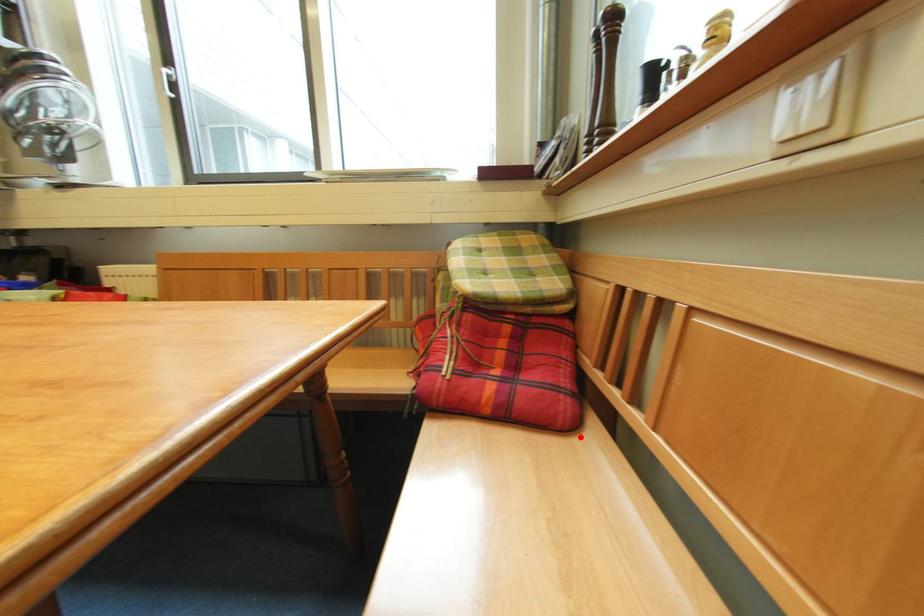
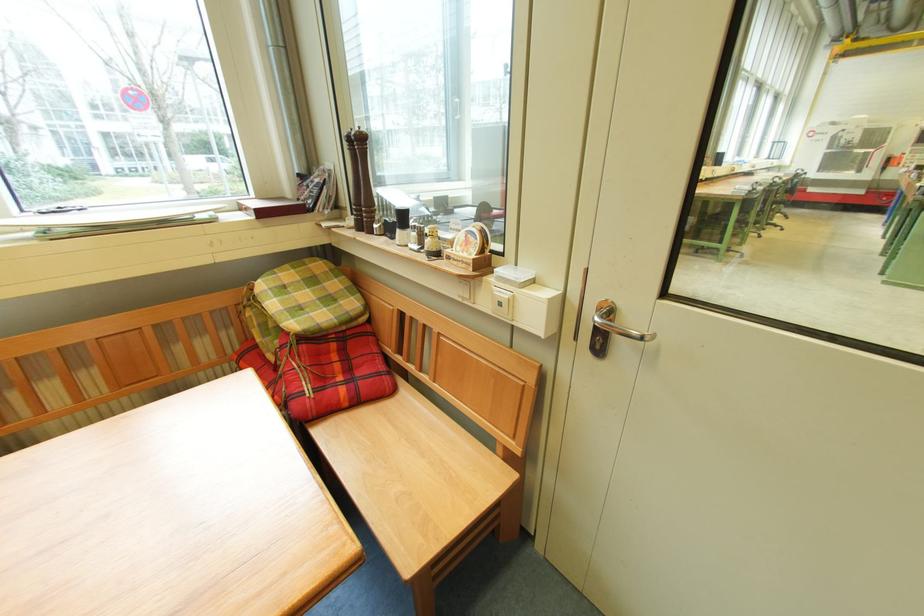
Where in the second image is the point corresponding to the highlighted location from the first image?

(403, 397)